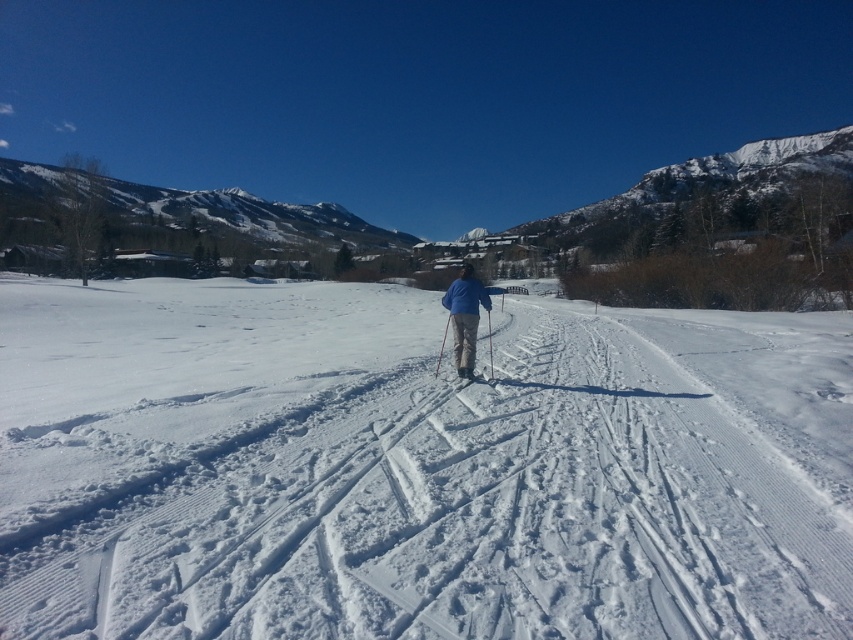
You are a photographer standing at the point with coordinates (465, 316). You want to take a photo of the blue fabric jacket at center. Is the blue fabric jacket at center visible from your current position?

The blue fabric jacket at center is located at point (465, 316), so you are standing directly at the position of the blue fabric jacket at center. Therefore, you cannot see it from your current position because you are at the same location.

You are a skier on the trail and you see two points marked on the snow ahead of you. The first point is at coordinates point (x=608, y=536) and the second is at point (x=489, y=356). Which point is closer to your current position?

Point (x=489, y=356) is closer to your current position because it is behind point (x=608, y=536), which is further ahead on the trail.

You are a photographer trying to capture a photo of the blue fabric jacket at center and the white textured snow at center. From the camera position, which object is located to the right of the other?

The white textured snow at center is positioned on the right side of blue fabric jacket at center, so the white textured snow at center is to the right of the blue fabric jacket at center.